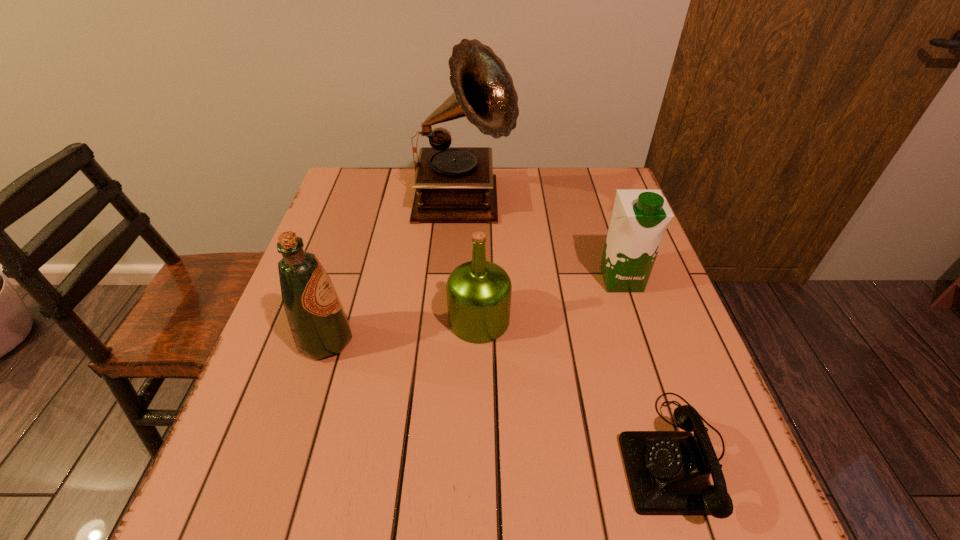
Find the location of a particular element. Image resolution: width=960 pixels, height=540 pixels. object situated at the near right corner is located at coordinates (668, 472).

Locate an element on the screen. The width and height of the screenshot is (960, 540). vacant space at the far edge is located at coordinates (516, 190).

Image resolution: width=960 pixels, height=540 pixels. I want to click on vacant space at the near edge, so click(437, 518).

Find the location of a particular element. The width and height of the screenshot is (960, 540). vacant area at the left edge of the desktop is located at coordinates (358, 239).

The image size is (960, 540). I want to click on vacant space at the right edge, so click(x=610, y=213).

Locate an element on the screen. vacant space at the far right corner is located at coordinates (581, 180).

At what (x,y) coordinates should I click in order to perform the action: click on free area in between the soya milk and the farthest object. Please return your answer as a coordinate pair (x, y). This screenshot has height=540, width=960. Looking at the image, I should click on (542, 242).

Where is `free space that is in between the second farthest object and the shorter olive oil`? This screenshot has height=540, width=960. free space that is in between the second farthest object and the shorter olive oil is located at coordinates (550, 300).

The height and width of the screenshot is (540, 960). In order to click on free space that is in between the farthest object and the leftmost object in this screenshot , I will do `click(395, 273)`.

Locate an element on the screen. The image size is (960, 540). unoccupied area between the nearest object and the second farthest object is located at coordinates (648, 367).